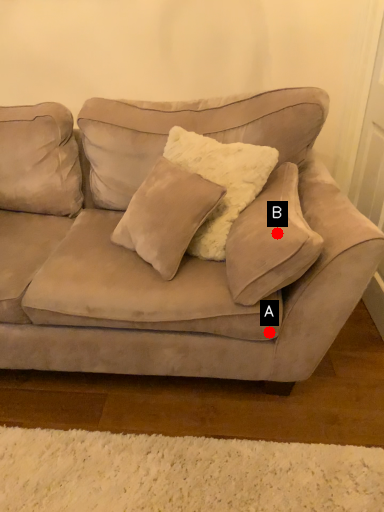
Question: Two points are circled on the image, labeled by A and B beside each circle. Which point is closer to the camera?

Choices:
 (A) A is closer
 (B) B is closer

Answer: (B)